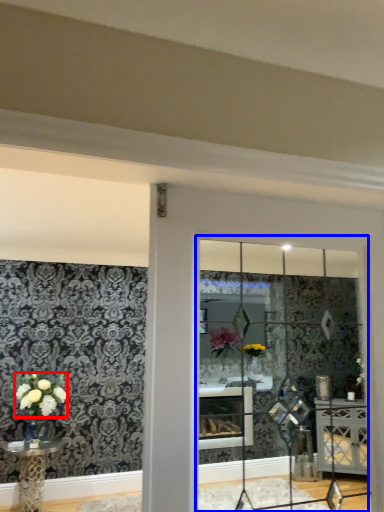
Question: Which object is closer to the camera taking this photo, flower (highlighted by a red box) or glass window (highlighted by a blue box)?

Choices:
 (A) flower
 (B) glass window

Answer: (B)